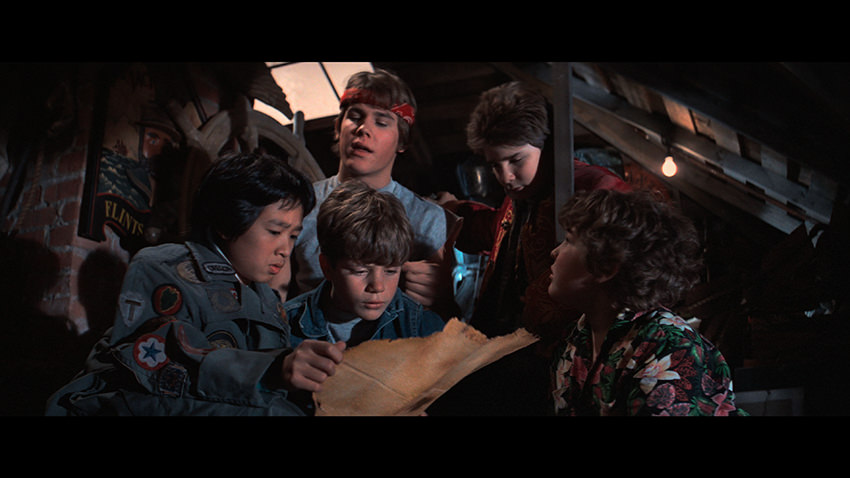
The image size is (850, 478). What are the coordinates of `light` in the screenshot? It's located at (666, 170).